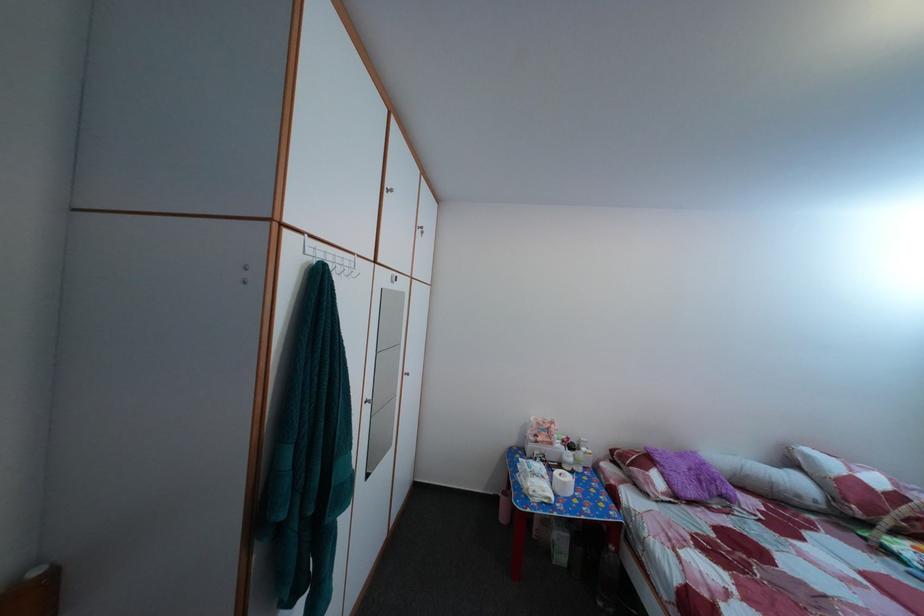
The location [562,483] corresponds to which object?

It corresponds to the paper towel roll in the image.